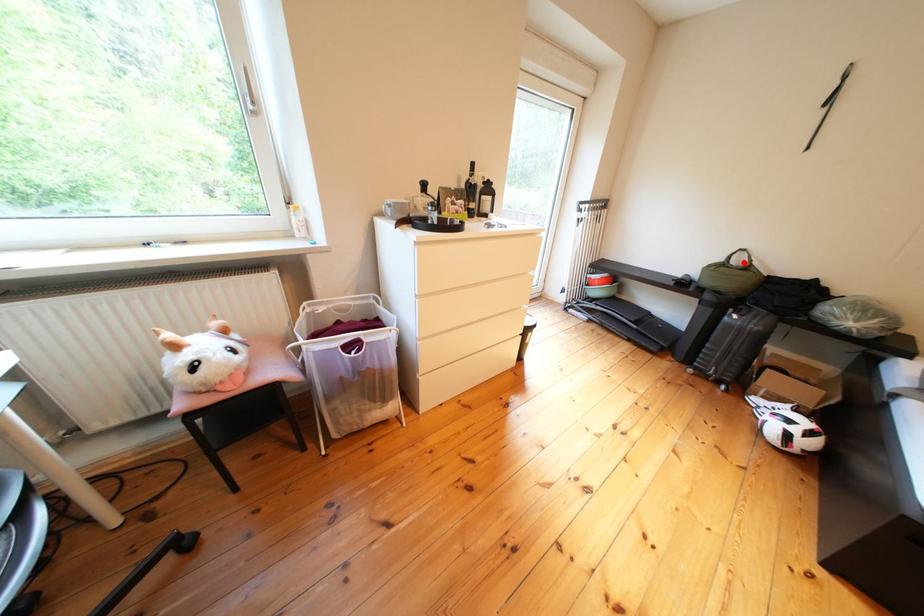
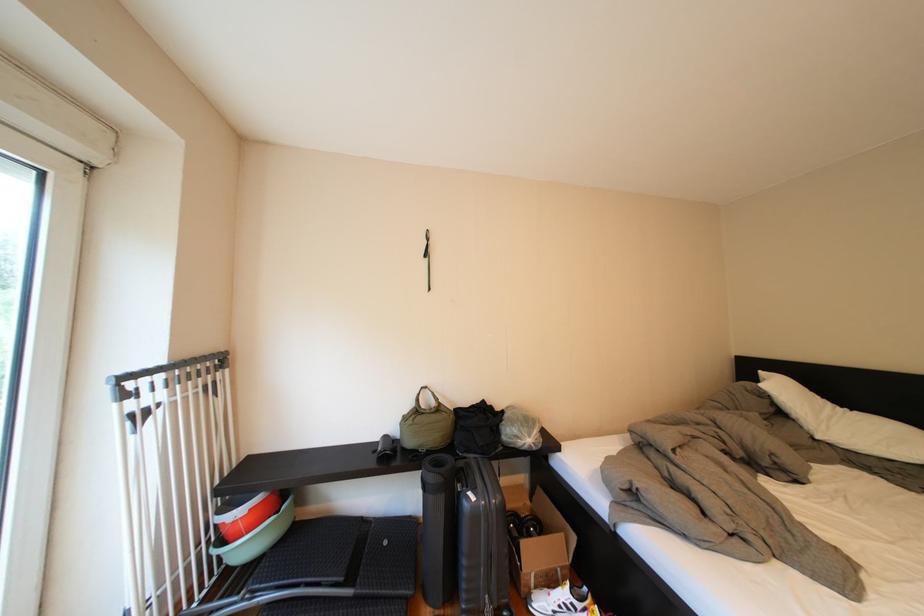
Locate, in the second image, the point that corresponds to the highlighted location in the first image.

(431, 405)